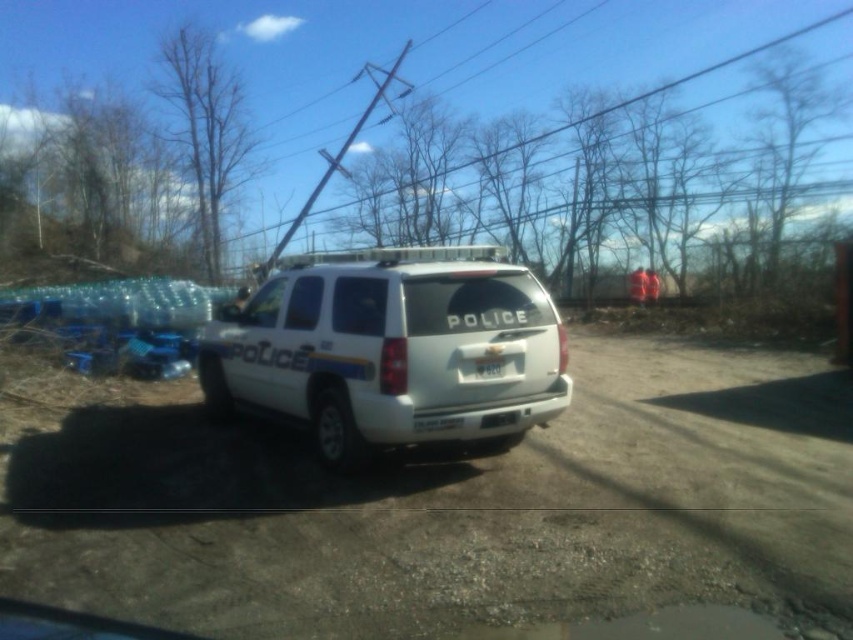
Question: From the image, what is the correct spatial relationship of white gravel dirt track at center in relation to white matte police suv at center?

Choices:
 (A) right
 (B) left

Answer: (B)

Question: Is white matte police suv at center thinner than white plastic license plate at center?

Choices:
 (A) yes
 (B) no

Answer: (B)

Question: Which of the following is the farthest from the observer?

Choices:
 (A) (482, 364)
 (B) (846, 632)

Answer: (A)

Question: Which of the following is the farthest from the observer?

Choices:
 (A) white plastic license plate at center
 (B) white gravel dirt track at center
 (C) white matte police suv at center

Answer: (C)

Question: Which of these objects is positioned closest to the white gravel dirt track at center?

Choices:
 (A) white plastic license plate at center
 (B) white matte police suv at center

Answer: (A)

Question: Can you confirm if white matte police suv at center is positioned to the left of white plastic license plate at center?

Choices:
 (A) yes
 (B) no

Answer: (B)